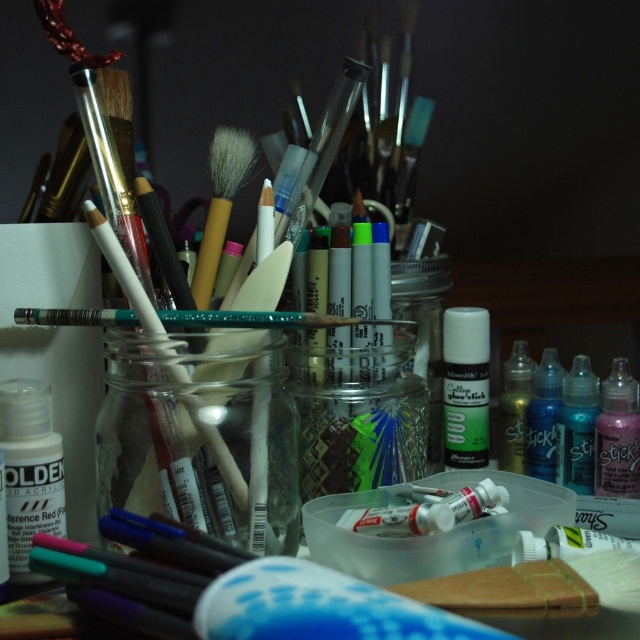
Is translucent plastic bottle at lower left taller than translucent plastic bottle at center right?

Yes.

Which is in front, point (0, 417) or point (522, 422)?

Point (0, 417)

This screenshot has height=640, width=640. I want to click on translucent plastic bottle at lower left, so click(29, 470).

The height and width of the screenshot is (640, 640). What do you see at coordinates (252, 320) in the screenshot?
I see `white matte paint brush at center` at bounding box center [252, 320].

Does point (13, 312) come in front of point (593, 376)?

Yes, point (13, 312) is in front of point (593, 376).

Where is `white matte paint brush at center`? This screenshot has width=640, height=640. white matte paint brush at center is located at coordinates tap(252, 320).

Where is `white matte paint brush at center`? The height and width of the screenshot is (640, 640). white matte paint brush at center is located at coordinates (252, 320).

Between point (259, 452) and point (605, 378), which one is positioned behind?

Point (605, 378)

Can you confirm if clear glass jar at center is positioned below pink glittery bottle at right?

No, clear glass jar at center is not below pink glittery bottle at right.

Between point (273, 387) and point (611, 401), which one is positioned behind?

The point (611, 401) is more distant.

This screenshot has width=640, height=640. I want to click on clear glass jar at center, so click(x=200, y=442).